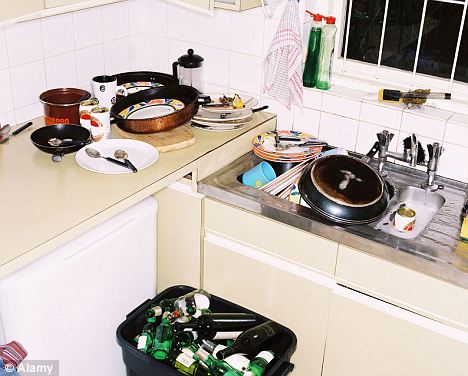
Identify the location of dish scrubber. This screenshot has height=376, width=468. (385, 94).